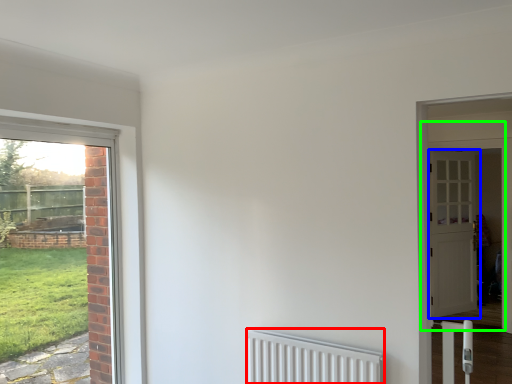
Question: Considering the real-world distances, which object is closest to radiator (highlighted by a red box)? door (highlighted by a blue box) or door (highlighted by a green box).

Choices:
 (A) door
 (B) door

Answer: (B)